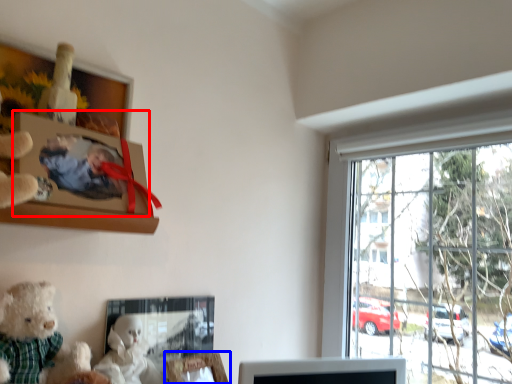
Question: Which of the following is the farthest to the observer, picture frame (highlighted by a red box) or picture frame (highlighted by a blue box)?

Choices:
 (A) picture frame
 (B) picture frame

Answer: (B)